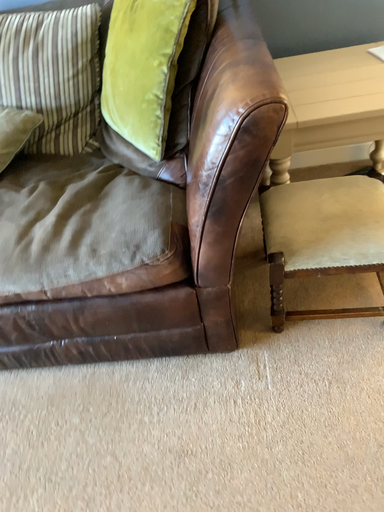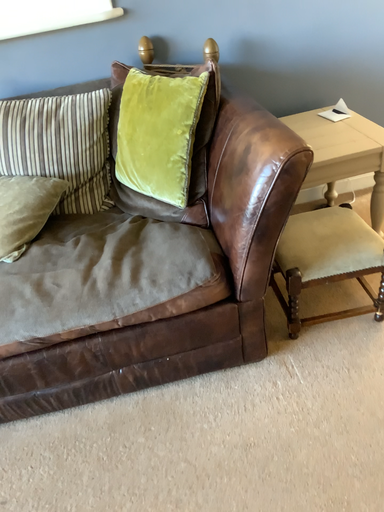
Question: Which way did the camera rotate in the video?

Choices:
 (A) rotated left
 (B) rotated right

Answer: (B)